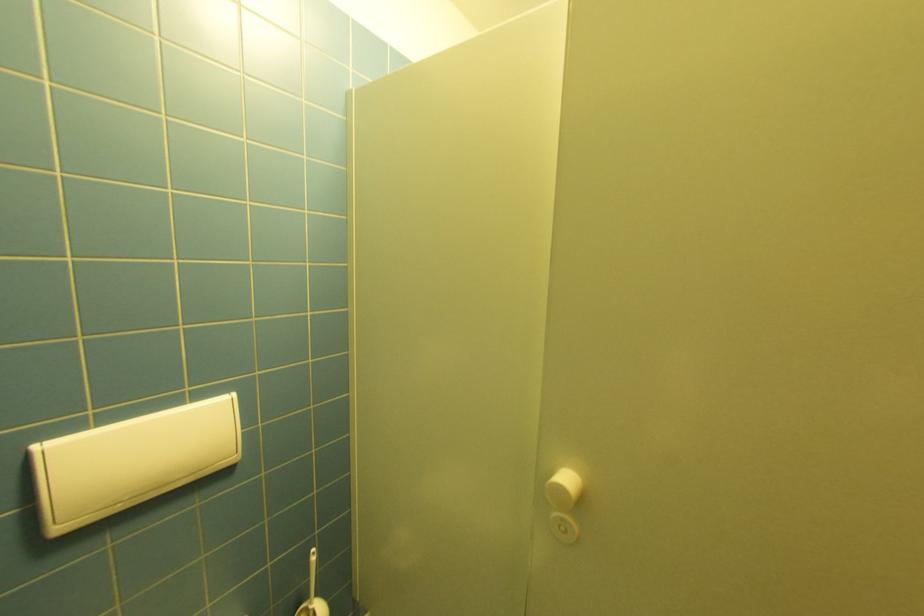
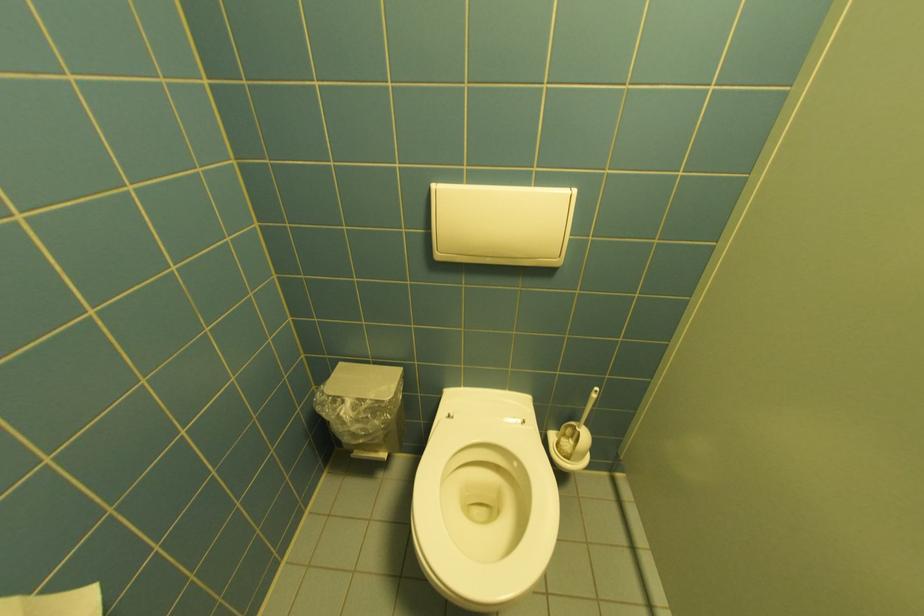
In the second image, find the point that corresponds to pixel 43 448 in the first image.

(440, 185)